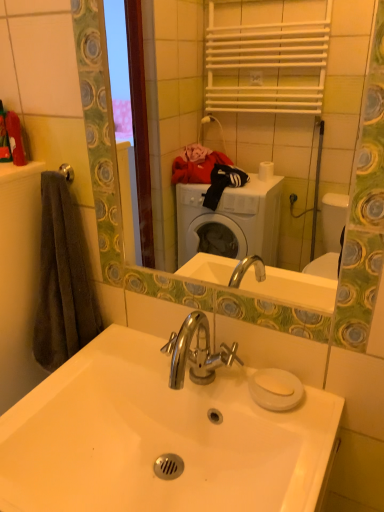
Question: From a real-world perspective, is silver metallic towel bar at upper left located higher than white glossy sink at center?

Choices:
 (A) yes
 (B) no

Answer: (A)

Question: Is silver metallic towel bar at upper left thinner than white glossy sink at center?

Choices:
 (A) yes
 (B) no

Answer: (A)

Question: Does silver metallic towel bar at upper left contain white glossy sink at center?

Choices:
 (A) yes
 (B) no

Answer: (B)

Question: Is silver metallic towel bar at upper left completely or partially outside of white glossy sink at center?

Choices:
 (A) yes
 (B) no

Answer: (A)

Question: From a real-world perspective, does silver metallic towel bar at upper left sit lower than white glossy sink at center?

Choices:
 (A) yes
 (B) no

Answer: (B)

Question: Does silver metallic towel bar at upper left appear on the right side of white glossy sink at center?

Choices:
 (A) yes
 (B) no

Answer: (B)

Question: Is white glossy sink at center looking in the opposite direction of dark gray towel at left?

Choices:
 (A) no
 (B) yes

Answer: (A)

Question: Does white glossy sink at center have a greater height compared to dark gray towel at left?

Choices:
 (A) no
 (B) yes

Answer: (A)

Question: Is white glossy sink at center at the right side of dark gray towel at left?

Choices:
 (A) yes
 (B) no

Answer: (A)

Question: Can you confirm if white glossy sink at center is wider than dark gray towel at left?

Choices:
 (A) yes
 (B) no

Answer: (A)

Question: Is white glossy sink at center thinner than dark gray towel at left?

Choices:
 (A) yes
 (B) no

Answer: (B)

Question: Is white glossy sink at center far from dark gray towel at left?

Choices:
 (A) no
 (B) yes

Answer: (A)

Question: From a real-world perspective, is white glossy sink at center physically above silver metallic towel bar at upper left?

Choices:
 (A) yes
 (B) no

Answer: (B)